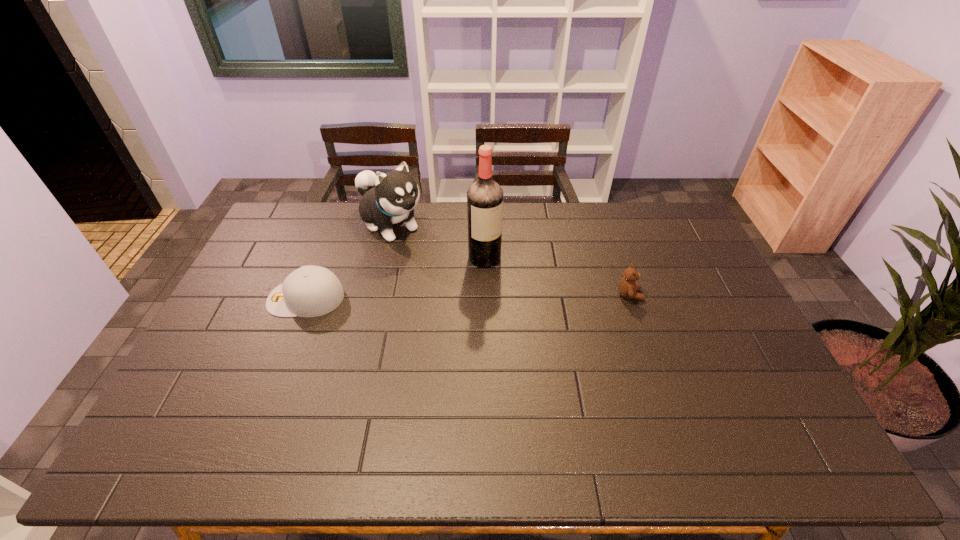
The image size is (960, 540). Find the location of `vacant space located at the face of the third shortest object`. vacant space located at the face of the third shortest object is located at coordinates (483, 307).

The height and width of the screenshot is (540, 960). In order to click on vacant region located at the face of the third shortest object in this screenshot , I will do `click(420, 251)`.

You are a GUI agent. You are given a task and a screenshot of the screen. Output one action in this format:
    pyautogui.click(x=<x>, y=<y>)
    Task: Click on the vacant space located 0.110m at the face of the third shortest object
    The width and height of the screenshot is (960, 540).
    Given the screenshot: What is the action you would take?
    pyautogui.click(x=428, y=259)

Identify the location of free space located 0.050m on the front-facing side of the third object from left to right. The height and width of the screenshot is (540, 960). (500, 276).

Locate an element on the screen. This screenshot has width=960, height=540. vacant space positioned 0.230m on the front-facing side of the third object from left to right is located at coordinates (530, 313).

Find the location of a particular element. vacant space situated 0.260m on the front-facing side of the third object from left to right is located at coordinates (536, 320).

Where is `object that is at the far edge`? Image resolution: width=960 pixels, height=540 pixels. object that is at the far edge is located at coordinates (389, 198).

The width and height of the screenshot is (960, 540). What are the coordinates of `object that is at the left edge` in the screenshot? It's located at (309, 291).

What are the coordinates of `vacant area at the far edge` in the screenshot? It's located at (544, 220).

Locate an element on the screen. Image resolution: width=960 pixels, height=540 pixels. free space at the near edge is located at coordinates (288, 416).